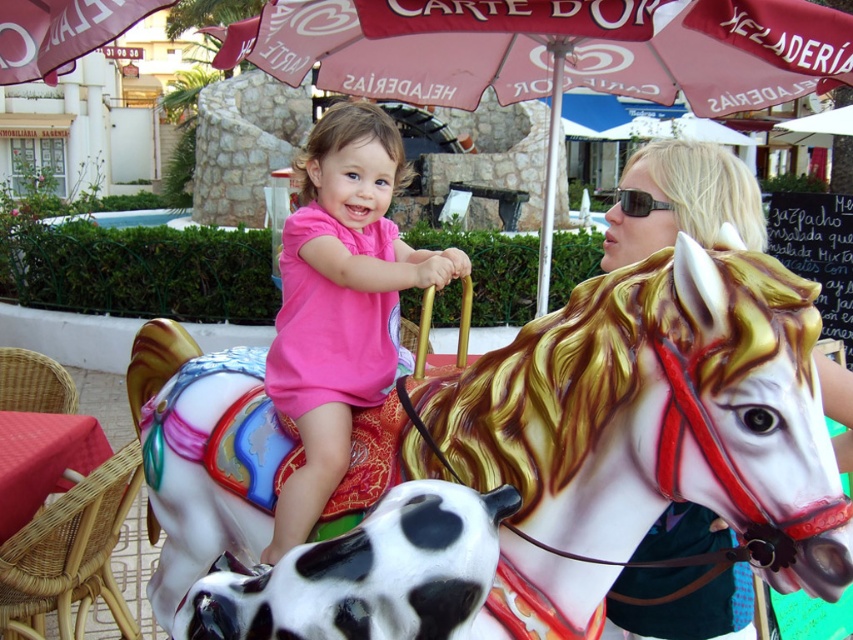
Who is shorter, painted wood horse at center or matte pink umbrella at upper center?

With less height is painted wood horse at center.

Does painted wood horse at center appear on the right side of matte pink umbrella at upper center?

No, painted wood horse at center is not to the right of matte pink umbrella at upper center.

Which is behind, point (566, 625) or point (508, 61)?

The point (508, 61) is more distant.

Locate an element on the screen. This screenshot has height=640, width=853. painted wood horse at center is located at coordinates (514, 465).

Can you confirm if matte pink umbrella at upper center is positioned below pink matte shirt at center?

No.

Who is higher up, matte pink umbrella at upper center or pink matte shirt at center?

matte pink umbrella at upper center is higher up.

Between point (619, 17) and point (289, 280), which one is positioned in front?

Point (289, 280) is more forward.

At what (x,y) coordinates should I click in order to perform the action: click on matte pink umbrella at upper center. Please return your answer as a coordinate pair (x, y). The width and height of the screenshot is (853, 640). Looking at the image, I should click on (550, 49).

Is pink matte shirt at center positioned behind matte white horse at upper right?

Yes, pink matte shirt at center is behind matte white horse at upper right.

Is pink matte shirt at center taller than matte white horse at upper right?

Yes.

Locate an element on the screen. The width and height of the screenshot is (853, 640). pink matte shirt at center is located at coordinates (340, 301).

You are a GUI agent. You are given a task and a screenshot of the screen. Output one action in this format:
    pyautogui.click(x=<x>, y=<y>)
    Task: Click on the pink matte shirt at center
    This screenshot has height=640, width=853.
    Given the screenshot: What is the action you would take?
    pyautogui.click(x=340, y=301)